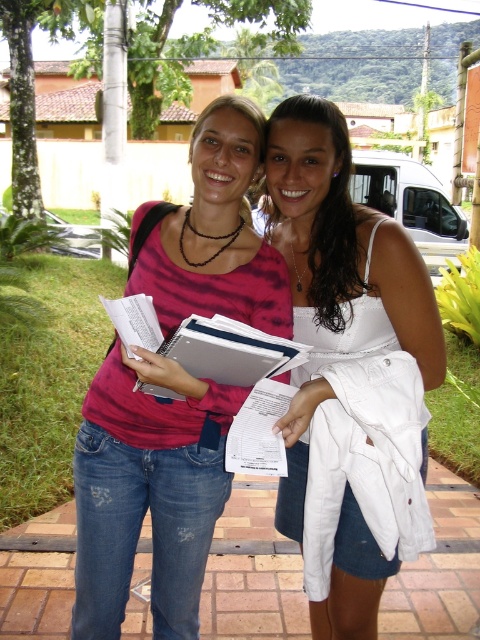
Is pink matte shirt at center further to the viewer compared to white fabric top at center?

No, pink matte shirt at center is closer to the viewer.

Does point (151, 435) come in front of point (319, 272)?

Yes.

Which is in front, point (149, 205) or point (296, 106)?

Point (296, 106) is more forward.

You are a GUI agent. You are given a task and a screenshot of the screen. Output one action in this format:
    pyautogui.click(x=<x>, y=<y>)
    Task: Click on the pink matte shirt at center
    This screenshot has height=640, width=480.
    Given the screenshot: What is the action you would take?
    pyautogui.click(x=147, y=490)

In the scene shown: Does pink matte shirt at center have a greater height compared to white satin tank top at center?

Correct, pink matte shirt at center is much taller as white satin tank top at center.

Is pink matte shirt at center positioned in front of white satin tank top at center?

Yes, pink matte shirt at center is in front of white satin tank top at center.

At what (x,y) coordinates should I click in order to perform the action: click on pink matte shirt at center. Please return your answer as a coordinate pair (x, y). This screenshot has height=640, width=480. Looking at the image, I should click on (147, 490).

Is white satin tank top at center to the left of white fabric top at center from the viewer's perspective?

In fact, white satin tank top at center is to the right of white fabric top at center.

Is point (297, 304) closer to viewer compared to point (342, 292)?

No, it is behind (342, 292).

This screenshot has height=640, width=480. Describe the element at coordinates (299, 189) in the screenshot. I see `white satin tank top at center` at that location.

Locate an element on the screen. white satin tank top at center is located at coordinates (299, 189).